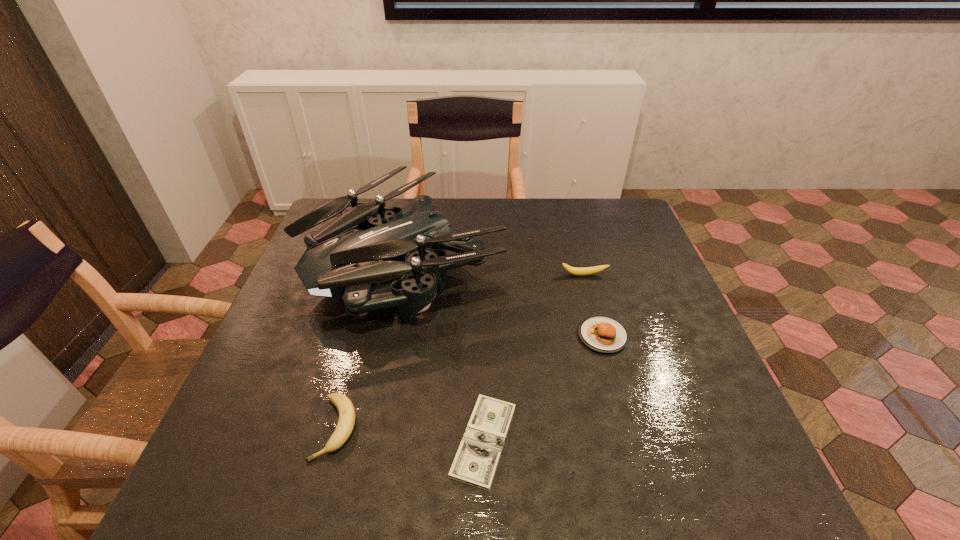
Identify the location of free space at the left edge of the desktop. (283, 369).

This screenshot has width=960, height=540. What are the coordinates of `vacant space at the right edge` in the screenshot? It's located at (698, 374).

In the image, there is a desktop. At what (x,y) coordinates should I click in order to perform the action: click on vacant space at the far right corner. Please return your answer as a coordinate pair (x, y). The image size is (960, 540). Looking at the image, I should click on (583, 206).

In the image, there is a desktop. At what (x,y) coordinates should I click in order to perform the action: click on free region at the near right corner. Please return your answer as a coordinate pair (x, y). The width and height of the screenshot is (960, 540). Looking at the image, I should click on (753, 465).

Find the location of a particular element. The height and width of the screenshot is (540, 960). free space between the left banana and the dollar is located at coordinates (410, 434).

Locate an element on the screen. Image resolution: width=960 pixels, height=540 pixels. vacant area between the dollar and the farther banana is located at coordinates (534, 358).

Find the location of `unoccupied area between the nearer banana and the taller banana`. unoccupied area between the nearer banana and the taller banana is located at coordinates (460, 352).

Where is `free space between the drone and the fourth tallest object`? The height and width of the screenshot is (540, 960). free space between the drone and the fourth tallest object is located at coordinates (371, 346).

Identify the location of free spot between the tallest object and the dollar. This screenshot has height=540, width=960. (445, 352).

You are a GUI agent. You are given a task and a screenshot of the screen. Output one action in this format:
    pyautogui.click(x=<x>, y=<y>)
    Task: Click on the blank region between the taller banana and the nearer banana
    
    Given the screenshot: What is the action you would take?
    pyautogui.click(x=460, y=352)